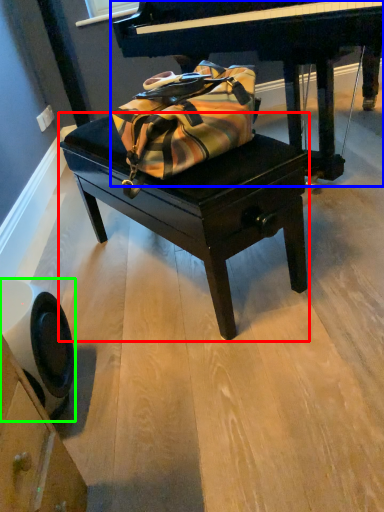
Question: Which object is positioned farthest from table (highlighted by a red box)? Select from piano (highlighted by a blue box) and swivel chair (highlighted by a green box).

Choices:
 (A) piano
 (B) swivel chair

Answer: (A)